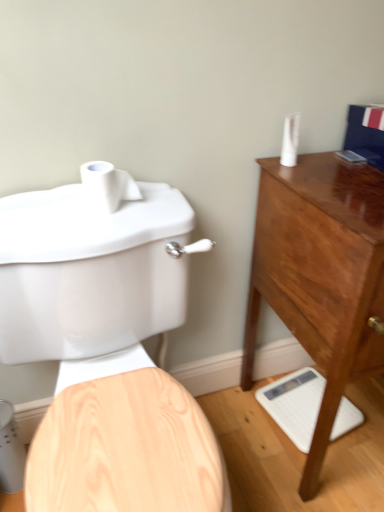
Describe the element at coordinates (108, 185) in the screenshot. I see `white matte toilet paper at upper left` at that location.

The width and height of the screenshot is (384, 512). I want to click on white plastic toothpaste tube at upper right, so click(x=290, y=140).

Is mahogany wood chest of drawers at right oriented towards white glossy scale at lower right?

No, mahogany wood chest of drawers at right does not turn towards white glossy scale at lower right.

Considering the relative sizes of mahogany wood chest of drawers at right and white glossy scale at lower right in the image provided, is mahogany wood chest of drawers at right taller than white glossy scale at lower right?

Yes.

Considering the positions of objects mahogany wood chest of drawers at right and white glossy scale at lower right in the image provided, who is more to the right, mahogany wood chest of drawers at right or white glossy scale at lower right?

Positioned to the right is mahogany wood chest of drawers at right.

Can you tell me how much mahogany wood chest of drawers at right and white glossy scale at lower right differ in facing direction?

There is a 11.5-degree angle between the facing directions of mahogany wood chest of drawers at right and white glossy scale at lower right.

Is white matte toilet paper at upper left looking in the opposite direction of matte white toilet at left?

No.

Considering the positions of point (97, 200) and point (84, 208), is point (97, 200) closer or farther from the camera than point (84, 208)?

Point (97, 200) is closer to the camera than point (84, 208).

Are white matte toilet paper at upper left and matte white toilet at left making contact?

They are not placed beside each other.

Where is `toilet paper above the matte white toilet at left (from a real-world perspective)`? toilet paper above the matte white toilet at left (from a real-world perspective) is located at coordinates (108, 185).

Could you tell me if white plastic toothpaste tube at upper right is facing white glossy scale at lower right?

No.

Does point (294, 139) come farther from viewer compared to point (286, 432)?

No, it is not.

Who is taller, white plastic toothpaste tube at upper right or white glossy scale at lower right?

Standing taller between the two is white plastic toothpaste tube at upper right.

How far apart are white plastic toothpaste tube at upper right and white glossy scale at lower right?

They are 80.41 centimeters apart.

Considering the positions of point (289, 156) and point (140, 196), is point (289, 156) closer or farther from the camera than point (140, 196)?

Point (289, 156) appears to be farther away from the viewer than point (140, 196).

Considering the relative sizes of white plastic toothpaste tube at upper right and white matte toilet paper at upper left in the image provided, is white plastic toothpaste tube at upper right wider than white matte toilet paper at upper left?

In fact, white plastic toothpaste tube at upper right might be narrower than white matte toilet paper at upper left.

Where is `toiletry on the right of white matte toilet paper at upper left`? Image resolution: width=384 pixels, height=512 pixels. toiletry on the right of white matte toilet paper at upper left is located at coordinates (290, 140).

Would you say white glossy scale at lower right is inside or outside matte white toilet at left?

white glossy scale at lower right is outside matte white toilet at left.

How different are the orientations of white glossy scale at lower right and matte white toilet at left in degrees?

The angular difference between white glossy scale at lower right and matte white toilet at left is 10.9 degrees.

Which is more to the left, white glossy scale at lower right or matte white toilet at left?

matte white toilet at left is more to the left.

Does white glossy scale at lower right come in front of matte white toilet at left?

No, it is behind matte white toilet at left.

Considering the sizes of white matte toilet paper at upper left and white glossy scale at lower right in the image, is white matte toilet paper at upper left bigger or smaller than white glossy scale at lower right?

In the image, white matte toilet paper at upper left appears to be smaller than white glossy scale at lower right.

From a real-world perspective, who is located lower, white matte toilet paper at upper left or white glossy scale at lower right?

white glossy scale at lower right, from a real-world perspective.

Does white matte toilet paper at upper left have a lesser height compared to white glossy scale at lower right?

Incorrect, the height of white matte toilet paper at upper left does not fall short of that of white glossy scale at lower right.

Is white matte toilet paper at upper left wider than white glossy scale at lower right?

No, white matte toilet paper at upper left is not wider than white glossy scale at lower right.

Where is `toilet paper located on the left of white plastic toothpaste tube at upper right`? Image resolution: width=384 pixels, height=512 pixels. toilet paper located on the left of white plastic toothpaste tube at upper right is located at coordinates (108, 185).

From the image's perspective, between white matte toilet paper at upper left and white plastic toothpaste tube at upper right, which one is located above?

white plastic toothpaste tube at upper right.

Considering the sizes of objects white matte toilet paper at upper left and white plastic toothpaste tube at upper right in the image provided, who is bigger, white matte toilet paper at upper left or white plastic toothpaste tube at upper right?

white matte toilet paper at upper left is bigger.

The height and width of the screenshot is (512, 384). What are the coordinates of `porcelain below the mahogany wood chest of drawers at right (from a real-world perspective)` in the screenshot? It's located at (295, 404).

This screenshot has width=384, height=512. What are the coordinates of `toilet located on the right of white matte toilet paper at upper left` in the screenshot? It's located at (105, 351).

From the image, which object appears to be farther from mahogany wood chest of drawers at right, white glossy scale at lower right or white plastic toothpaste tube at upper right?

white glossy scale at lower right is positioned further to the anchor mahogany wood chest of drawers at right.

Based on the photo, which object lies further to the anchor point white glossy scale at lower right, mahogany wood chest of drawers at right or white plastic toothpaste tube at upper right?

white plastic toothpaste tube at upper right lies further to white glossy scale at lower right than the other object.

Estimate the real-world distances between objects in this image. Which object is further from white glossy scale at lower right, white matte toilet paper at upper left or mahogany wood chest of drawers at right?

white matte toilet paper at upper left is positioned further to the anchor white glossy scale at lower right.

When comparing their distances from white plastic toothpaste tube at upper right, does white glossy scale at lower right or mahogany wood chest of drawers at right seem closer?

Among the two, mahogany wood chest of drawers at right is located nearer to white plastic toothpaste tube at upper right.

Based on their spatial positions, is mahogany wood chest of drawers at right or white plastic toothpaste tube at upper right closer to matte white toilet at left?

Based on the image, mahogany wood chest of drawers at right appears to be nearer to matte white toilet at left.

Based on their spatial positions, is white glossy scale at lower right or white matte toilet paper at upper left further from white plastic toothpaste tube at upper right?

white glossy scale at lower right is further to white plastic toothpaste tube at upper right.

Estimate the real-world distances between objects in this image. Which object is closer to white glossy scale at lower right, matte white toilet at left or mahogany wood chest of drawers at right?

The object closer to white glossy scale at lower right is mahogany wood chest of drawers at right.

Which object lies nearer to the anchor point matte white toilet at left, white plastic toothpaste tube at upper right or white glossy scale at lower right?

white plastic toothpaste tube at upper right.

I want to click on toilet paper that lies between white plastic toothpaste tube at upper right and white glossy scale at lower right from top to bottom, so click(x=108, y=185).

Locate an element on the screen. porcelain between white matte toilet paper at upper left and mahogany wood chest of drawers at right is located at coordinates (295, 404).

In order to click on toiletry between matte white toilet at left and white glossy scale at lower right from front to back in this screenshot , I will do `click(290, 140)`.

Identify the location of chest of drawers between white plastic toothpaste tube at upper right and matte white toilet at left in the up-down direction. pos(320,275).